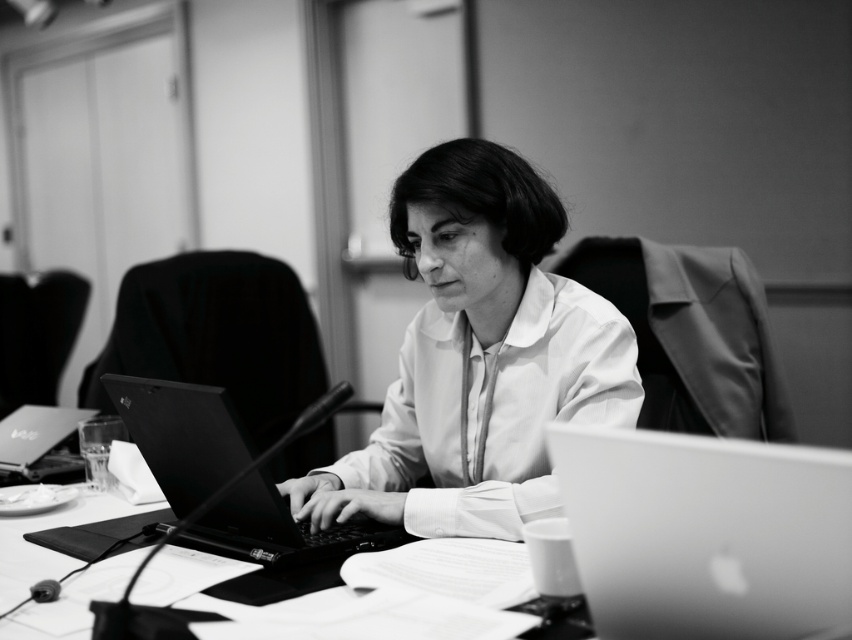
Can you confirm if black matte laptop at center is positioned below matte black laptop at left?

Actually, black matte laptop at center is above matte black laptop at left.

Identify the location of black matte laptop at center. (225, 477).

How much distance is there between sleek silver laptop at center and matte black laptop at left?

sleek silver laptop at center is 5.04 feet away from matte black laptop at left.

Consider the image. Is sleek silver laptop at center bigger than matte black laptop at left?

No.

What do you see at coordinates (706, 534) in the screenshot?
I see `sleek silver laptop at center` at bounding box center [706, 534].

This screenshot has height=640, width=852. I want to click on sleek silver laptop at center, so click(x=706, y=534).

Which is below, white smooth shirt at center or sleek silver laptop at center?

sleek silver laptop at center is lower down.

Is white smooth shirt at center below sleek silver laptop at center?

Incorrect, white smooth shirt at center is not positioned below sleek silver laptop at center.

Locate an element on the screen. The height and width of the screenshot is (640, 852). white smooth shirt at center is located at coordinates (479, 358).